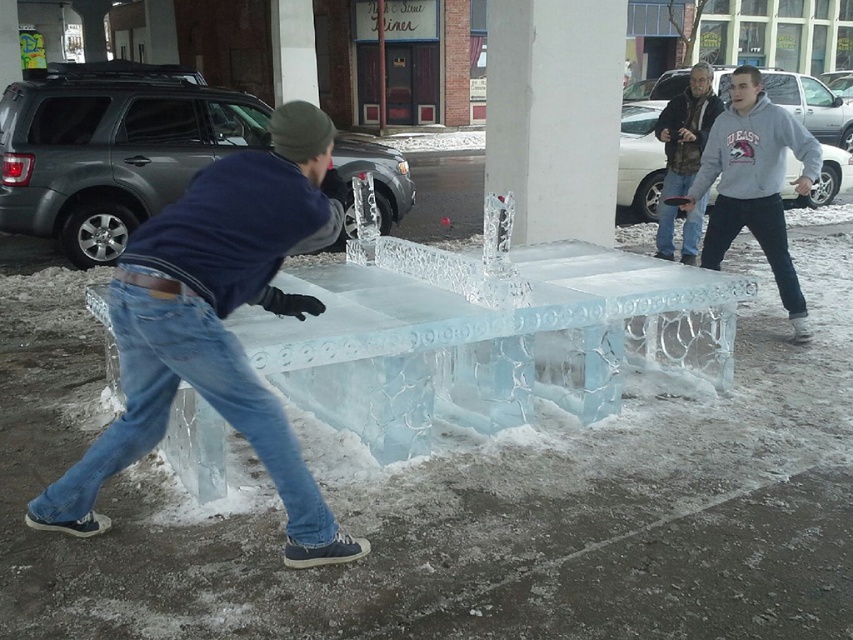
Based on the photo, you are a fashion designer observing the two people in the image. Which clothing item, the gray fleece sweatshirt at right or the blue jeans at center, is covering part of the other?

The gray fleece sweatshirt at right is positioned over the blue jeans at center, so it is covering part of the blue jeans at center.

You are standing near the two people in the winter scene. You want to know which object is taller between the white smooth concrete pillar at center and the gray fleece sweatshirt at right. Can you tell me?

The white smooth concrete pillar at center is taller than the gray fleece sweatshirt at right.